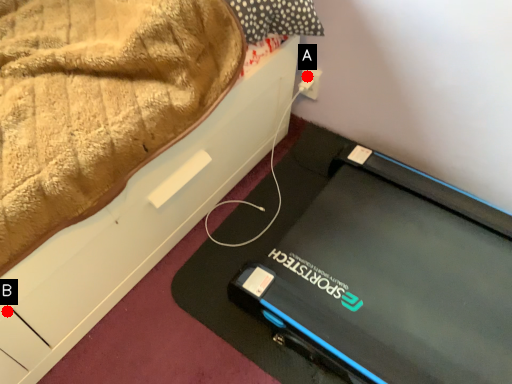
Question: Two points are circled on the image, labeled by A and B beside each circle. Which of the following is the closest to the observer?

Choices:
 (A) A is closer
 (B) B is closer

Answer: (B)